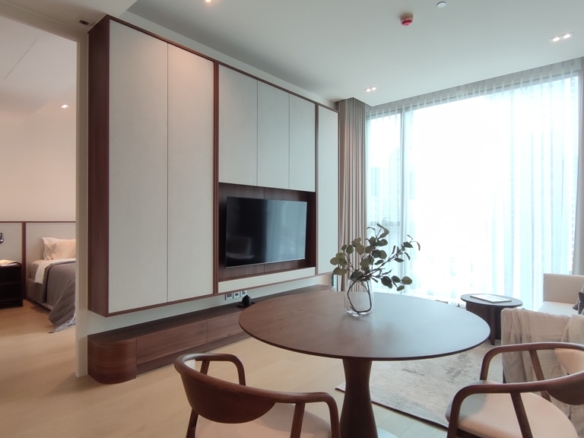
Where is `window`? The width and height of the screenshot is (584, 438). window is located at coordinates (490, 178).